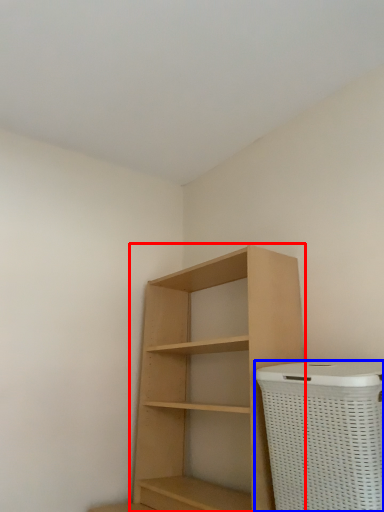
Question: Which point is closer to the camera, shelf (highlighted by a red box) or basket container (highlighted by a blue box)?

Choices:
 (A) shelf
 (B) basket container

Answer: (B)